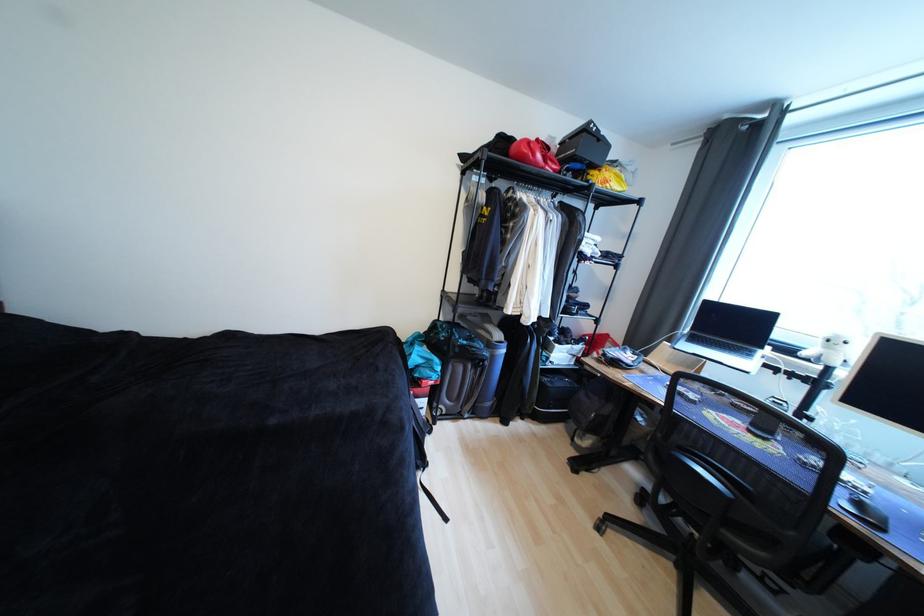
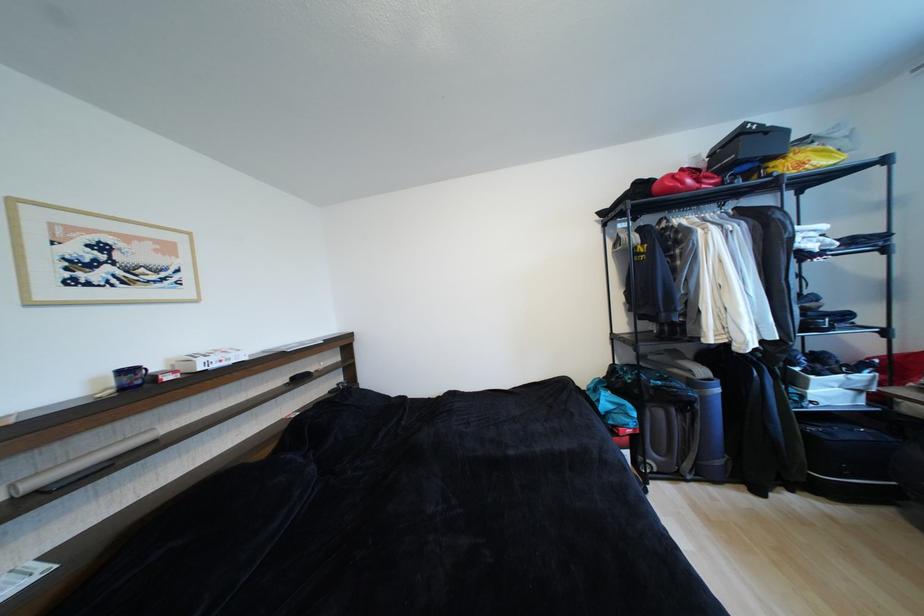
The point at (599,174) is marked in the first image. Where is the corresponding point in the second image?

(780, 166)